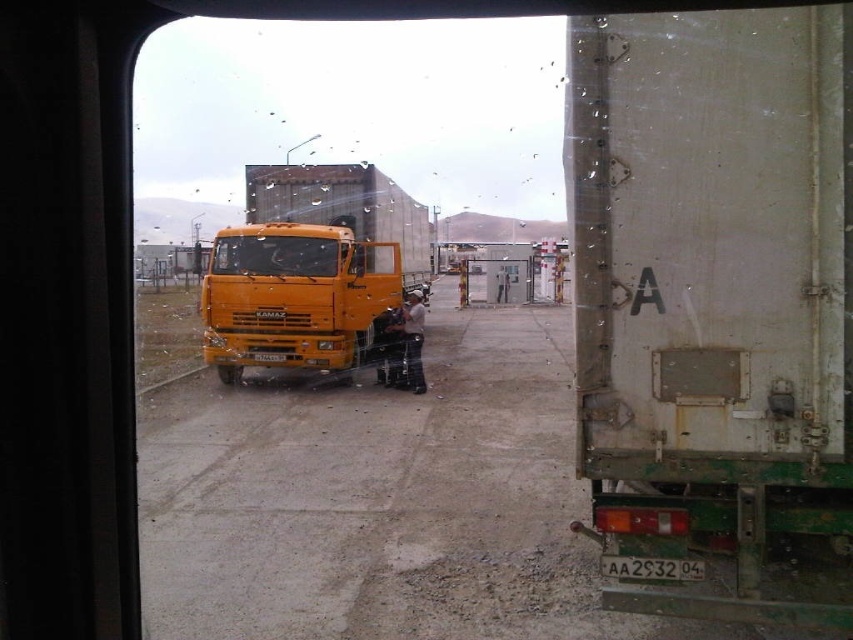
Between rusty metal trailer at right and orange matte truck at center, which one appears on the right side from the viewer's perspective?

From the viewer's perspective, rusty metal trailer at right appears more on the right side.

Which of these two, rusty metal trailer at right or orange matte truck at center, stands shorter?

Standing shorter between the two is orange matte truck at center.

You are a GUI agent. You are given a task and a screenshot of the screen. Output one action in this format:
    pyautogui.click(x=<x>, y=<y>)
    Task: Click on the rusty metal trailer at right
    
    Given the screenshot: What is the action you would take?
    pyautogui.click(x=715, y=308)